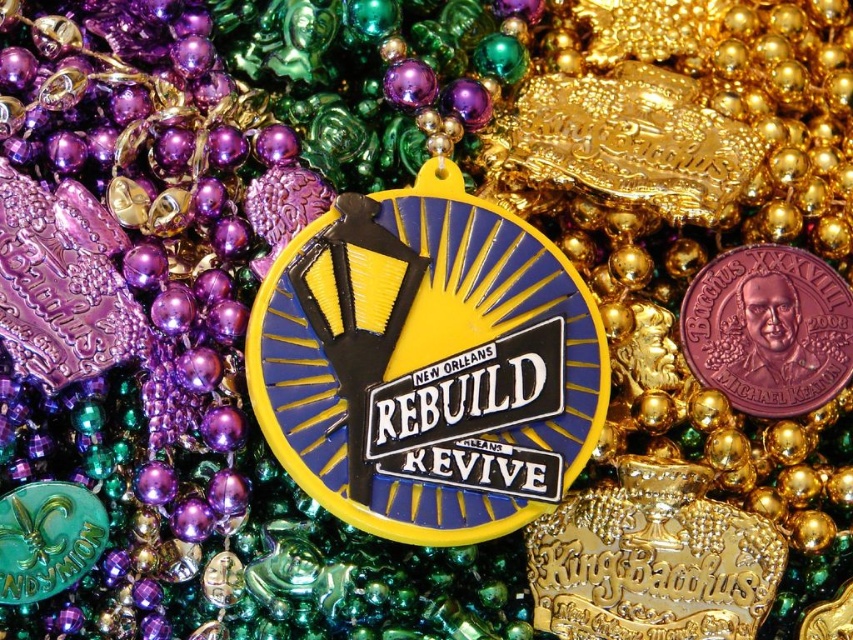
Question: Is yellow plastic badge at center wider than pink clay coin at center?

Choices:
 (A) yes
 (B) no

Answer: (A)

Question: Among these points, which one is nearest to the camera?

Choices:
 (A) (529, 500)
 (B) (796, 276)

Answer: (A)

Question: Does yellow plastic badge at center come behind pink clay coin at center?

Choices:
 (A) yes
 (B) no

Answer: (B)

Question: Can you confirm if yellow plastic badge at center is positioned below pink clay coin at center?

Choices:
 (A) yes
 (B) no

Answer: (A)